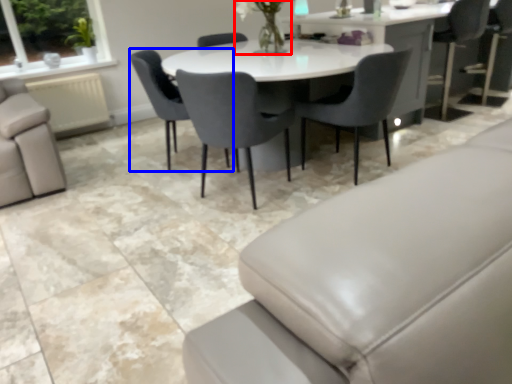
Question: Which point is further to the camera, floral arrangement (highlighted by a red box) or chair (highlighted by a blue box)?

Choices:
 (A) floral arrangement
 (B) chair

Answer: (B)